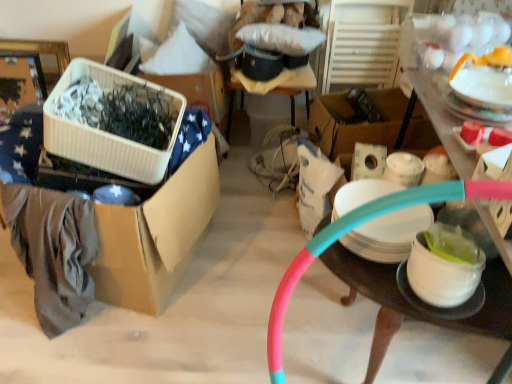
The width and height of the screenshot is (512, 384). I want to click on free region on the left part of white glossy bowl at lower right, which is the 1th tableware from bottom to top, so click(372, 275).